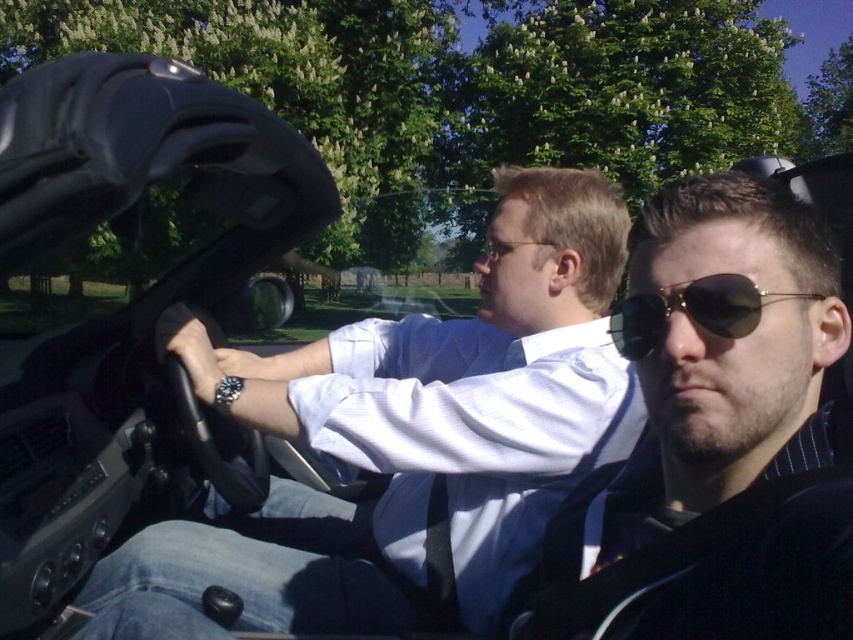
You are a photographer trying to capture a clear shot of the matte black sunglasses at center while also including the camera in the frame. Given that the two objects are 22.38 inches apart, what is the minimum focal length lens you should use to ensure both are in focus without distortion?

The minimum focal length lens required would depend on the sensor size of the camera and the desired depth of field. However, as a general guideline, a focal length of at least 50mm is often recommended for portraits to avoid distortion while keeping both the matte black sunglasses at center and the camera in focus at 22.38 inches apart.

You are sitting in the driver seat of the convertible and want to reach the point at (747, 230). Is it behind the point at (738, 285)?

Yes, the point at (747, 230) is behind the point at (738, 285).

You are a passenger in a convertible and want to grab your sunglasses from the center console between the driver and passenger seats. Which sunglasses, the matte black sunglasses at center or the gold reflective sunglasses at center, will you reach first?

The matte black sunglasses at center is closer to the viewer than the gold reflective sunglasses at center, so you will reach the matte black sunglasses at center first.